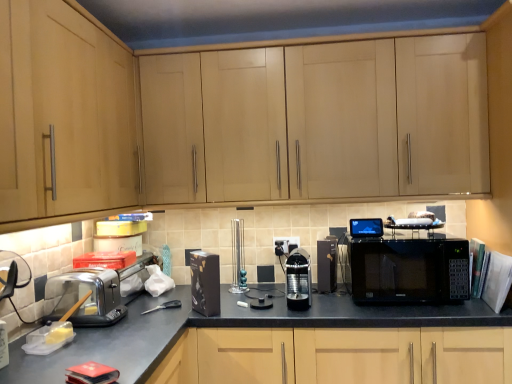
Identify the location of vacant area that is in front of sleek black coffee machine at center, the 2th appliance positioned from the right. (303, 314).